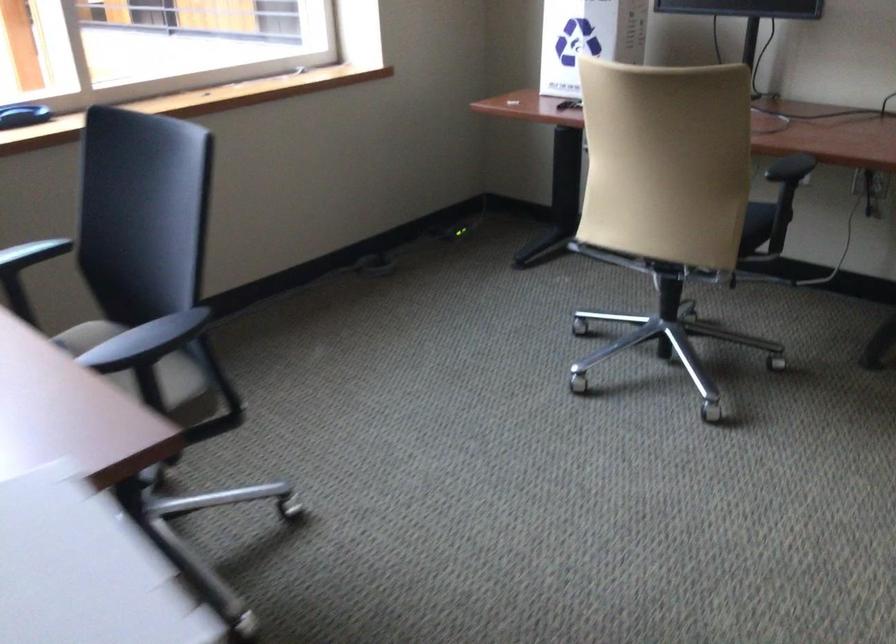
Where is `beige chair armrest`? beige chair armrest is located at coordinates (790, 167).